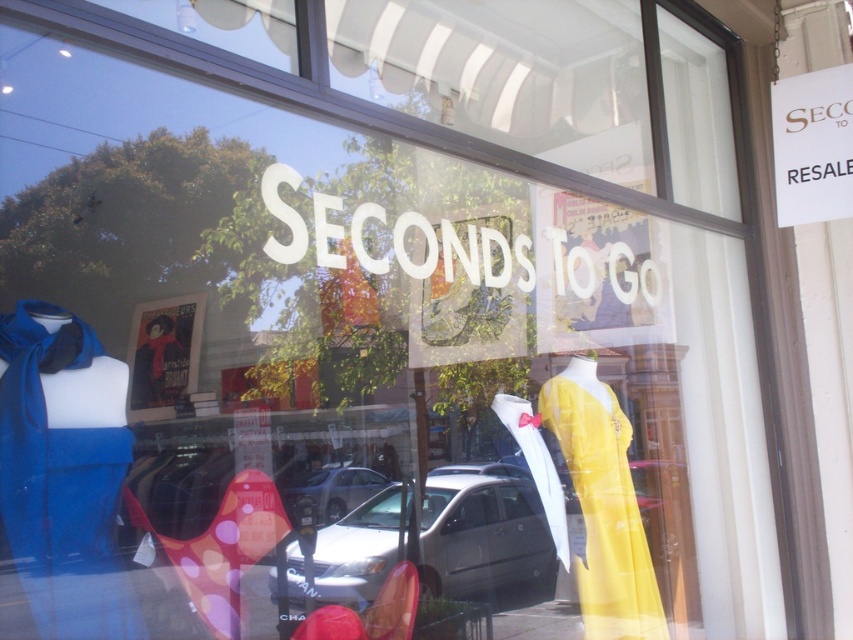
Who is shorter, silver metallic van at center or yellow satin dress at center?

silver metallic van at center

Which is behind, point (430, 480) or point (613, 531)?

The point (430, 480) is more distant.

Who is more forward, (x=469, y=561) or (x=641, y=573)?

Point (x=641, y=573) is in front.

This screenshot has width=853, height=640. In order to click on silver metallic van at center in this screenshot , I will do `click(483, 532)`.

Between yellow satin dress at center and silver metallic car at center, which one has less height?

silver metallic car at center is shorter.

Is yellow satin dress at center bigger than silver metallic car at center?

Incorrect, yellow satin dress at center is not larger than silver metallic car at center.

Locate an element on the screen. Image resolution: width=853 pixels, height=640 pixels. yellow satin dress at center is located at coordinates 602,506.

Consider the image. Does silver metallic van at center have a lesser height compared to silver metallic car at center?

Incorrect, silver metallic van at center's height does not fall short of silver metallic car at center's.

Can you confirm if silver metallic van at center is positioned to the right of silver metallic car at center?

Indeed, silver metallic van at center is positioned on the right side of silver metallic car at center.

I want to click on silver metallic van at center, so tap(483, 532).

Where is `silver metallic van at center`? The image size is (853, 640). silver metallic van at center is located at coordinates (483, 532).